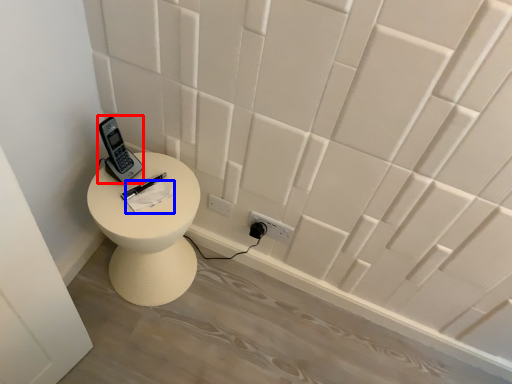
Question: Among these objects, which one is farthest to the camera, control (highlighted by a red box) or notepad (highlighted by a blue box)?

Choices:
 (A) control
 (B) notepad

Answer: (B)